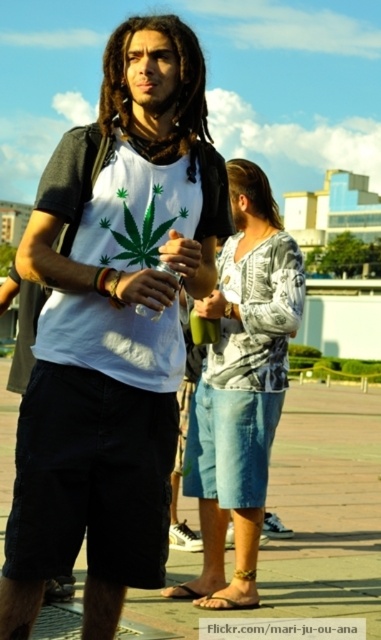
Question: Does brown/dry/dreadlocks at center appear on the left side of brown wavy hair at upper center?

Choices:
 (A) no
 (B) yes

Answer: (B)

Question: Does white matte t-shirt at center appear on the right side of brown wavy hair at upper center?

Choices:
 (A) no
 (B) yes

Answer: (A)

Question: Can you confirm if white matte t-shirt at center is positioned to the left of denim shorts at center?

Choices:
 (A) no
 (B) yes

Answer: (B)

Question: Which of the following is the closest to the observer?

Choices:
 (A) brown/dry/dreadlocks at center
 (B) brown wavy hair at upper center
 (C) brown brick pavement at center

Answer: (A)

Question: Which point is closer to the camera taking this photo?

Choices:
 (A) (315, 572)
 (B) (246, 497)
 (C) (144, 372)
 (D) (166, 108)

Answer: (C)

Question: Among these points, which one is farthest from the camera?

Choices:
 (A) (281, 227)
 (B) (160, 32)

Answer: (A)